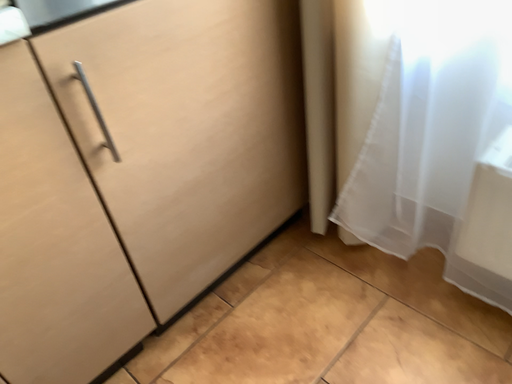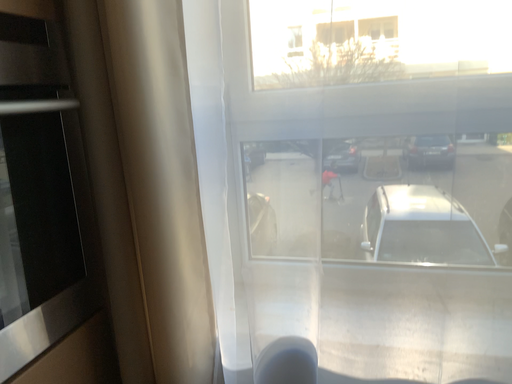
Question: How did the camera likely rotate when shooting the video?

Choices:
 (A) rotated upward
 (B) rotated downward

Answer: (A)